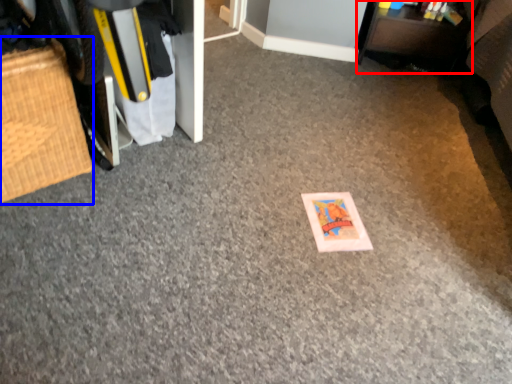
Question: Which of the following is the closest to the observer, furniture (highlighted by a red box) or furniture (highlighted by a blue box)?

Choices:
 (A) furniture
 (B) furniture

Answer: (B)